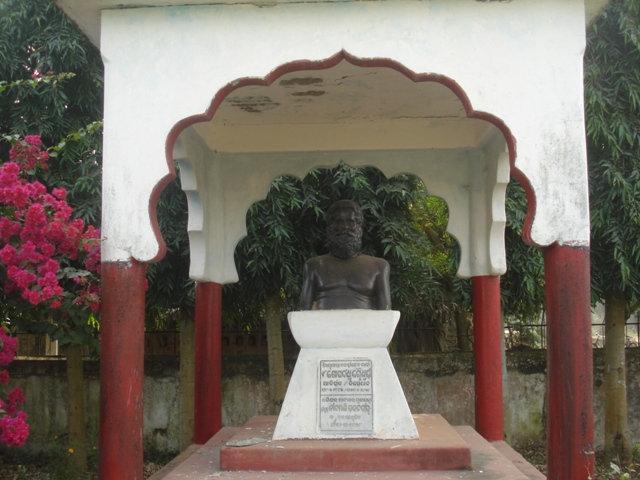
Find the location of a particular element. This screenshot has height=480, width=640. pillar is located at coordinates (493, 350), (566, 346), (203, 364), (129, 396).